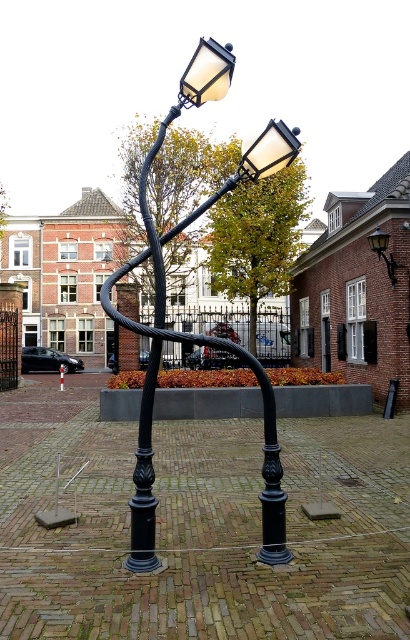
You are standing at the center of the street and want to locate the matte glass streetlight at upper center. According to the coordinates provided, where should you look relative to your current position?

The matte glass streetlight at upper center is located at coordinates point (207, 74), which means it is positioned to the left and slightly above your current position.

You are a city planner assessing the placement of the matte glass streetlight at upper center and the matte black lamp at upper right. Based on their positions, which one is positioned higher in the image?

The matte glass streetlight at upper center is positioned higher than the matte black lamp at upper right.